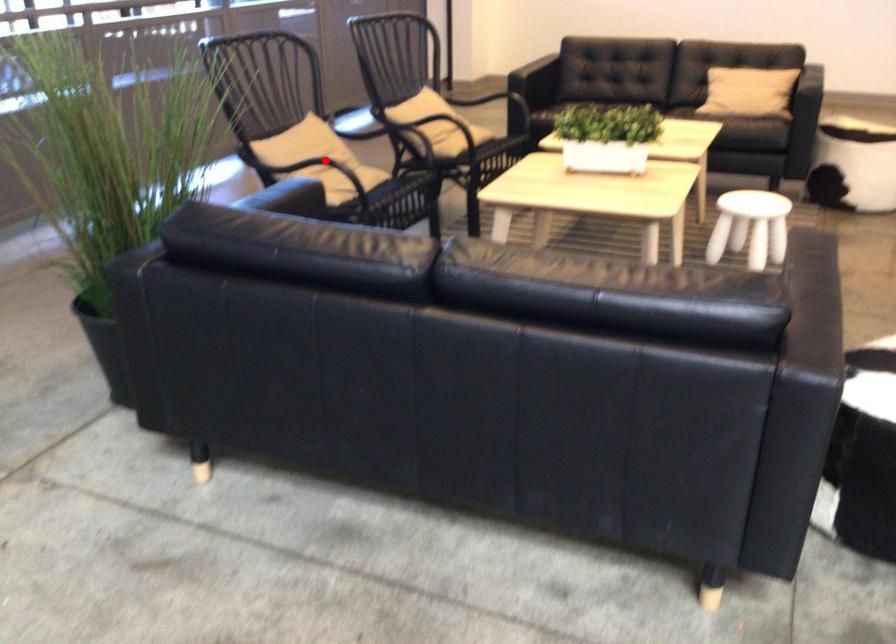
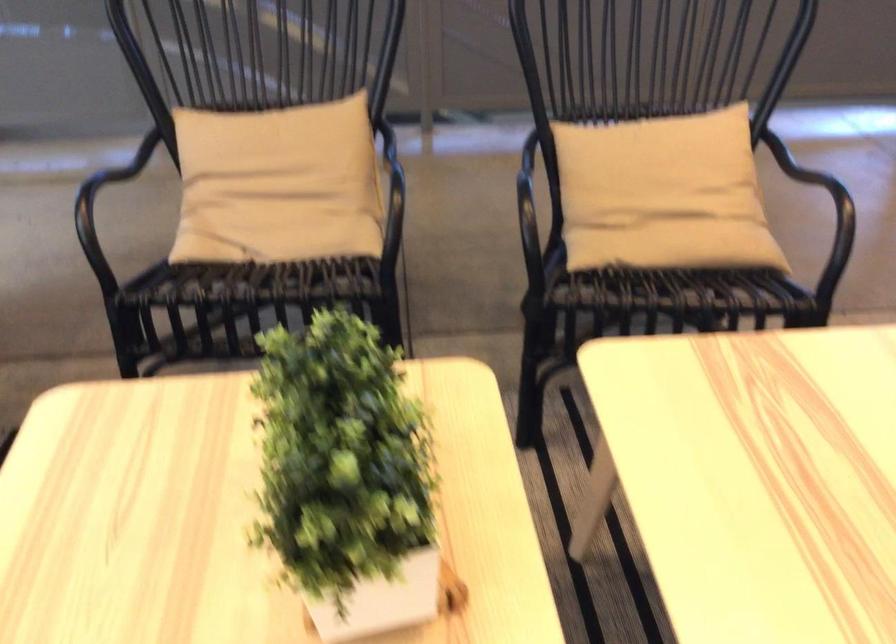
Question: I am providing you with two images of the same scene from different viewpoints. In image1, a red point is highlighted. Considering the same 3D point in image2, which of the following is correct?

Choices:
 (A) It is closer
 (B) It is farther

Answer: (A)